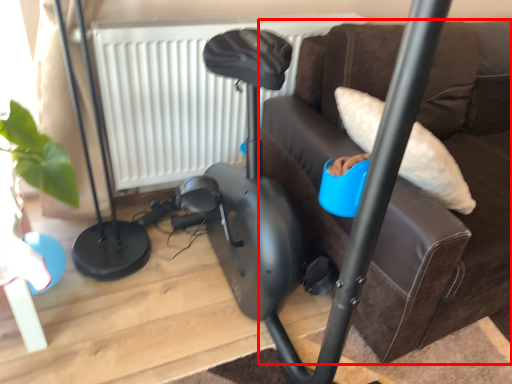
Question: From the image's perspective, where is furniture (annotated by the red box) located in relation to radiator in the image?

Choices:
 (A) below
 (B) above

Answer: (A)